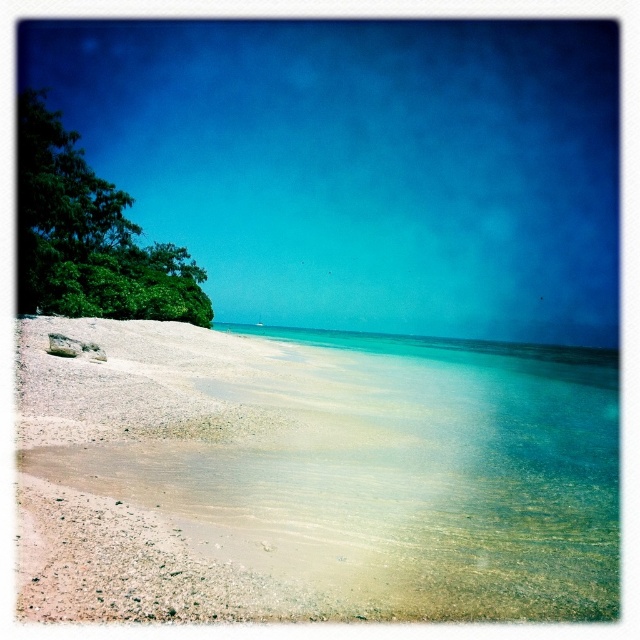
Which is more to the right, sandy beach at lower left or green leafy tree at left?

sandy beach at lower left

Who is more distant from viewer, (612, 364) or (97, 195)?

Point (612, 364)

The height and width of the screenshot is (640, 640). What are the coordinates of `sandy beach at lower left` in the screenshot? It's located at (314, 476).